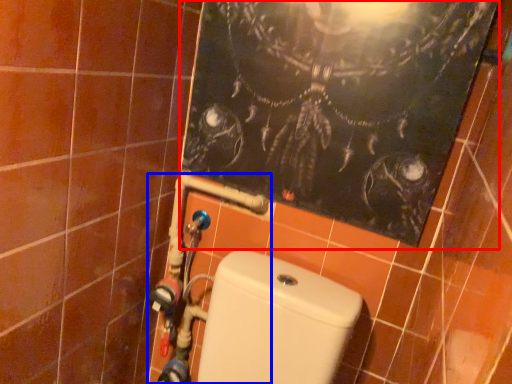
Question: Which object is further to the camera taking this photo, bulletin board (highlighted by a red box) or water pipe (highlighted by a blue box)?

Choices:
 (A) bulletin board
 (B) water pipe

Answer: (B)